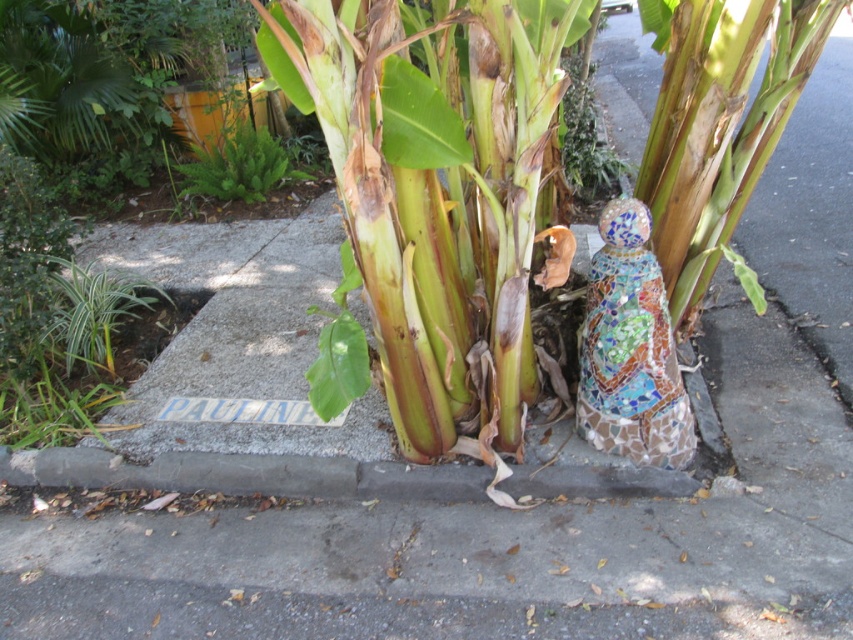
Based on the photo, you are standing at the point marked as point (439, 192) in the garden. What object is exactly at your current location?

The green matte banana tree at center is exactly at point (439, 192).

You are a gardener who needs to water both the green matte banana tree at center and the mosaic figure at center. Since the water hose is only 1.5 meters long, will you be able to reach both objects from your current position without moving the hose? Please explain your reasoning based on their sizes and positions.

The green matte banana tree at center is much taller than the mosaic figure at center. However, the question is about reaching them with a hose. Since both objects are at the center, the distance from the hose to each would depend on their positions relative to each other and the hose location. The description does not provide information about their horizontal distance from the hose or each other, only their height difference. Therefore, it is impossible to determine if the hose can reach both without more